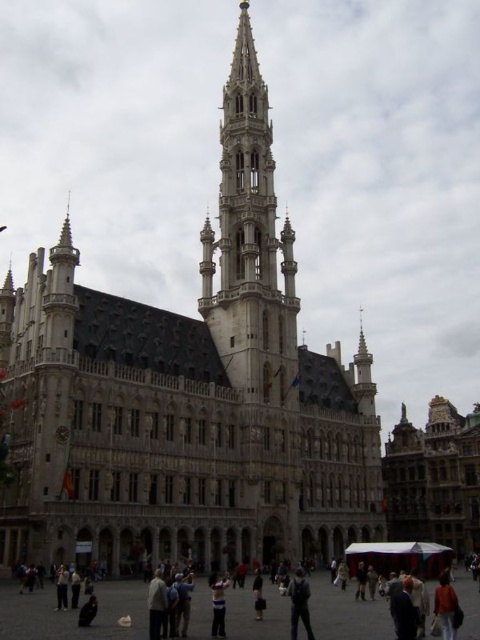
How much distance is there between brick paved square at center and dark gray pants at center?

brick paved square at center is 8.01 meters away from dark gray pants at center.

Between brick paved square at center and dark gray pants at center, which one has less height?

With less height is dark gray pants at center.

You are a GUI agent. You are given a task and a screenshot of the screen. Output one action in this format:
    pyautogui.click(x=<x>, y=<y>)
    Task: Click on the brick paved square at center
    The width and height of the screenshot is (480, 640).
    Given the screenshot: What is the action you would take?
    (72, 612)

Is brick paved square at center closer to the viewer compared to light brown leather jacket at center?

No, it is behind light brown leather jacket at center.

Between point (228, 616) and point (155, 570), which one is positioned in front?

Positioned in front is point (228, 616).

Is point (33, 604) farther from camera compared to point (162, 604)?

That is True.

Find the location of a particular element. Image resolution: width=480 pixels, height=640 pixels. brick paved square at center is located at coordinates (72, 612).

Does orange fabric jacket at lower right appear on the right side of light brown leather jacket at center?

Indeed, orange fabric jacket at lower right is positioned on the right side of light brown leather jacket at center.

This screenshot has width=480, height=640. I want to click on orange fabric jacket at lower right, so click(x=446, y=608).